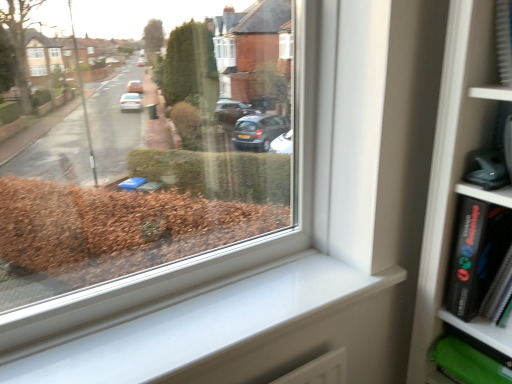
Where is `free space above white smooth window sill at lower right (from a real-world perspective)`? The width and height of the screenshot is (512, 384). free space above white smooth window sill at lower right (from a real-world perspective) is located at coordinates (216, 310).